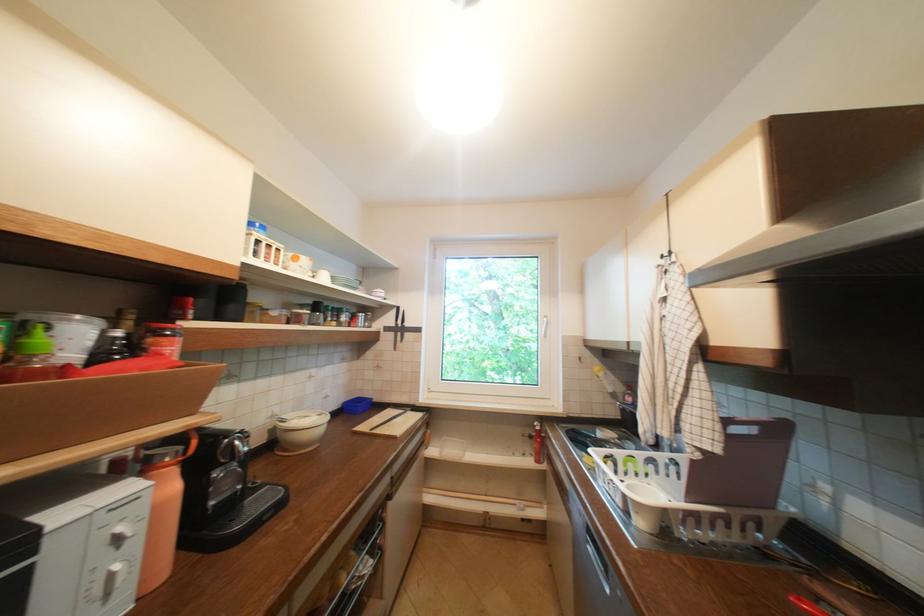
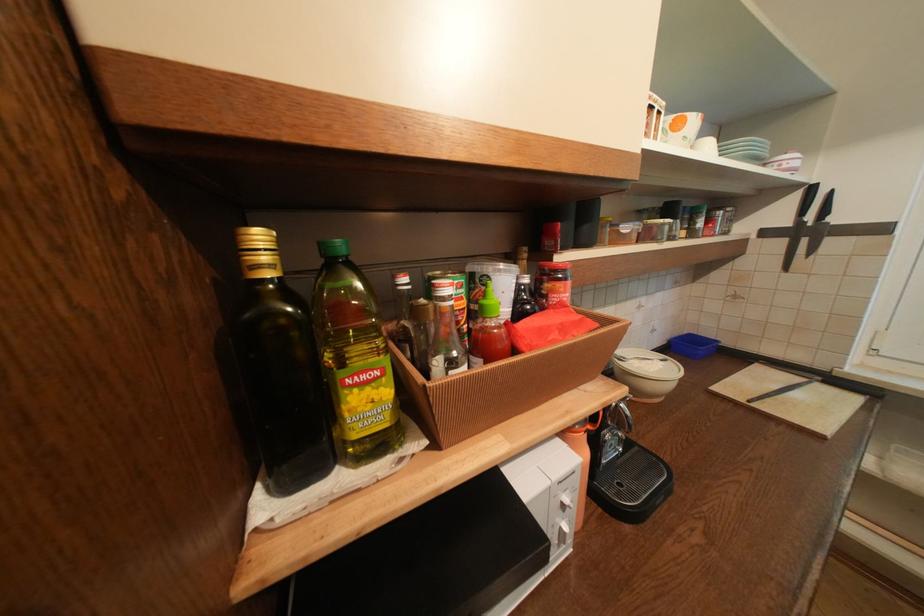
Locate, in the second image, the point that corresponds to (x=407, y=334) in the first image.

(812, 241)